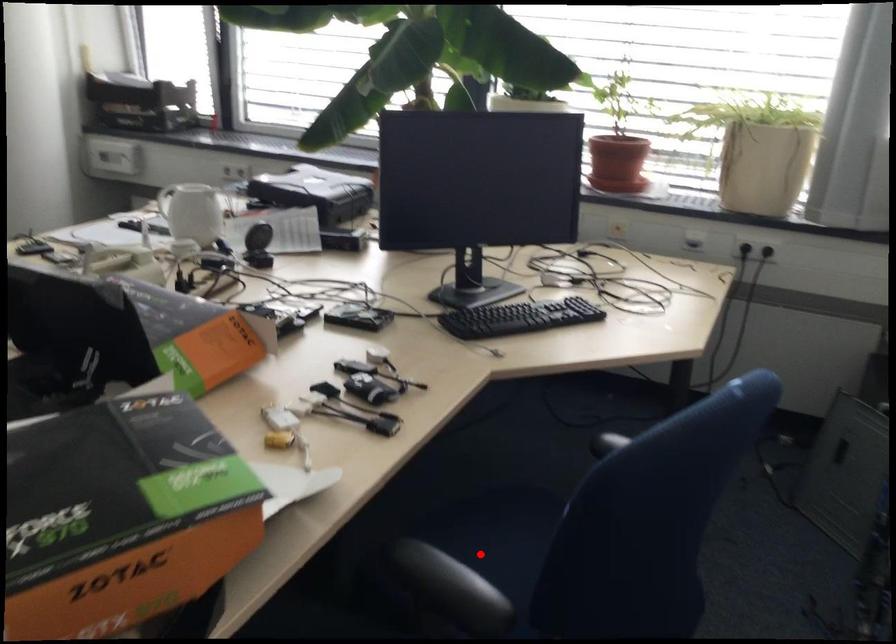
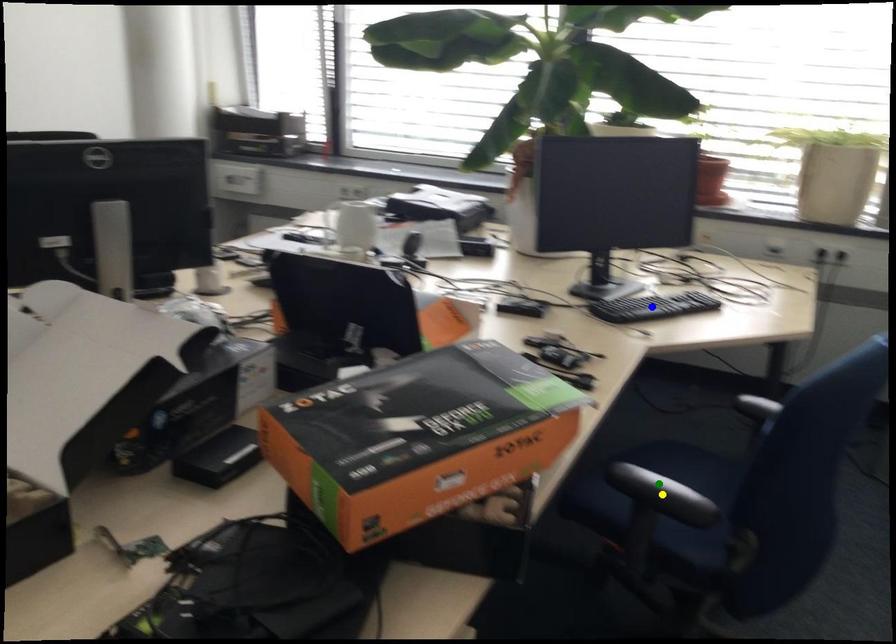
Question: I am providing you with two images of the same scene from different viewpoints. A red point is marked on the first image. You are given multiple points on the second image. Which spot in image 2 lines up with the point in image 1?

Choices:
 (A) green point
 (B) blue point
 (C) yellow point

Answer: (A)